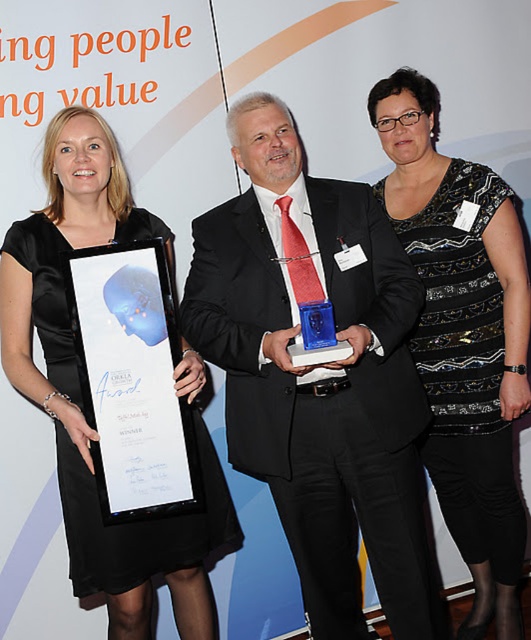
Does point (469, 544) lie behind point (108, 452)?

Yes.

Can you confirm if black sequined dress at center is shorter than white paper at left?

No, black sequined dress at center is not shorter than white paper at left.

Is point (449, 186) in front of point (142, 385)?

No, (449, 186) is further to viewer.

Locate an element on the screen. black sequined dress at center is located at coordinates (464, 337).

Is matte black suit at center to the left of satin black dress at left from the viewer's perspective?

In fact, matte black suit at center is to the right of satin black dress at left.

Between matte black suit at center and satin black dress at left, which one is positioned higher?

matte black suit at center is higher up.

Who is more forward, (232, 316) or (119, 616)?

Positioned in front is point (232, 316).

This screenshot has height=640, width=531. Find the location of `matte black suit at center`. matte black suit at center is located at coordinates (319, 376).

Is satin black dress at left thinner than white paper at left?

Incorrect, satin black dress at left's width is not less than white paper at left's.

Between point (91, 227) and point (136, 508), which one is positioned in front?

Point (136, 508) is more forward.

Where is `satin black dress at left`? This screenshot has width=531, height=640. satin black dress at left is located at coordinates click(81, 390).